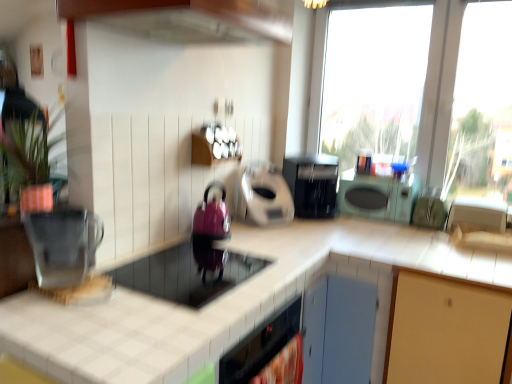
What do you see at coordinates (418, 102) in the screenshot? This screenshot has height=384, width=512. I see `transparent glass window at upper right` at bounding box center [418, 102].

This screenshot has width=512, height=384. I want to click on white matte toaster at center, the second appliance positioned from the right, so click(x=265, y=195).

Which appliance is the 1st one when counting from the right side of the metallic silver kettle at left, marked as the 5th appliance in a right-to-left arrangement? Please provide its 2D coordinates.

[(187, 273)]

Considering the relative sizes of metallic silver kettle at left, marked as the 5th appliance in a right-to-left arrangement, and shiny black kettle at center, which ranks as the 4th appliance in right-to-left order, in the image provided, is metallic silver kettle at left, marked as the 5th appliance in a right-to-left arrangement, bigger than shiny black kettle at center, which ranks as the 4th appliance in right-to-left order,?

Actually, metallic silver kettle at left, marked as the 5th appliance in a right-to-left arrangement, might be smaller than shiny black kettle at center, which ranks as the 4th appliance in right-to-left order.

Does metallic silver kettle at left, which is the first appliance from left to right, contain shiny black kettle at center, positioned as the second appliance in left-to-right order?

No, shiny black kettle at center, positioned as the second appliance in left-to-right order, is located outside of metallic silver kettle at left, which is the first appliance from left to right.

Can you confirm if metallic silver kettle at left, which is the first appliance from left to right, is shorter than shiny black kettle at center, positioned as the second appliance in left-to-right order?

Incorrect, the height of metallic silver kettle at left, which is the first appliance from left to right, does not fall short of that of shiny black kettle at center, positioned as the second appliance in left-to-right order.

Is matte pink kettle at center, the third appliance viewed from the left, facing away from green matte plant at upper left?

No, matte pink kettle at center, the third appliance viewed from the left,'s orientation is not away from green matte plant at upper left.

Is matte pink kettle at center, which is counted as the third appliance, starting from the right, inside the boundaries of green matte plant at upper left, or outside?

matte pink kettle at center, which is counted as the third appliance, starting from the right, exists outside the volume of green matte plant at upper left.

Based on the photo, which is more to the right, matte pink kettle at center, which is counted as the third appliance, starting from the right, or green matte plant at upper left?

From the viewer's perspective, matte pink kettle at center, which is counted as the third appliance, starting from the right, appears more on the right side.

From a real-world perspective, is matte pink kettle at center, the third appliance viewed from the left, over green matte plant at upper left?

No, from a real-world perspective, matte pink kettle at center, the third appliance viewed from the left, is not above green matte plant at upper left.

Does shiny black kettle at center, which ranks as the 4th appliance in right-to-left order, touch green matte plant at upper left?

shiny black kettle at center, which ranks as the 4th appliance in right-to-left order, and green matte plant at upper left are not in contact.

Which of these two, shiny black kettle at center, positioned as the second appliance in left-to-right order, or green matte plant at upper left, is bigger?

shiny black kettle at center, positioned as the second appliance in left-to-right order.

From the image's perspective, is shiny black kettle at center, which ranks as the 4th appliance in right-to-left order, beneath green matte plant at upper left?

Correct, shiny black kettle at center, which ranks as the 4th appliance in right-to-left order, appears lower than green matte plant at upper left in the image.

Identify the location of countertop that appears below the white matte toaster at center, the 4th appliance from the left (from a real-world perspective). (229, 302).

Is beige tile countertop at center not close to white matte toaster at center, the second appliance positioned from the right?

No, there isn't a large distance between beige tile countertop at center and white matte toaster at center, the second appliance positioned from the right.

Can you confirm if beige tile countertop at center is bigger than white matte toaster at center, the 4th appliance from the left?

Yes.

Is beige tile countertop at center inside or outside of white matte toaster at center, the second appliance positioned from the right?

beige tile countertop at center lies outside white matte toaster at center, the second appliance positioned from the right.

Between point (207, 262) and point (208, 238), which one is positioned in front?

Point (207, 262)

Could you tell me if shiny black kettle at center, positioned as the second appliance in left-to-right order, is turned towards matte pink kettle at center, which is counted as the third appliance, starting from the right?

No, shiny black kettle at center, positioned as the second appliance in left-to-right order, is not aimed at matte pink kettle at center, which is counted as the third appliance, starting from the right.

Considering the sizes of objects shiny black kettle at center, which ranks as the 4th appliance in right-to-left order, and matte pink kettle at center, the third appliance viewed from the left, in the image provided, who is shorter, shiny black kettle at center, which ranks as the 4th appliance in right-to-left order, or matte pink kettle at center, the third appliance viewed from the left,?

With less height is shiny black kettle at center, which ranks as the 4th appliance in right-to-left order.

Would you say shiny black kettle at center, positioned as the second appliance in left-to-right order, is a long distance from matte pink kettle at center, which is counted as the third appliance, starting from the right?

No, shiny black kettle at center, positioned as the second appliance in left-to-right order, is not far away from matte pink kettle at center, which is counted as the third appliance, starting from the right.

Considering the relative positions of black plastic coffee maker at center and metallic silver toaster at right, the 5th appliance when ordered from left to right, in the image provided, is black plastic coffee maker at center to the left or to the right of metallic silver toaster at right, the 5th appliance when ordered from left to right,?

From the image, it's evident that black plastic coffee maker at center is to the left of metallic silver toaster at right, the 5th appliance when ordered from left to right.

From a real-world perspective, who is located higher, black plastic coffee maker at center or metallic silver toaster at right, positioned as the 1th appliance in right-to-left order?

In real-world perspective, black plastic coffee maker at center is above.

Is black plastic coffee maker at center not inside metallic silver toaster at right, the 5th appliance when ordered from left to right?

Absolutely, black plastic coffee maker at center is external to metallic silver toaster at right, the 5th appliance when ordered from left to right.

From the picture: Measure the distance between black plastic coffee maker at center and metallic silver toaster at right, positioned as the 1th appliance in right-to-left order.

black plastic coffee maker at center is 23.93 inches away from metallic silver toaster at right, positioned as the 1th appliance in right-to-left order.

From the image's perspective, which one is positioned lower, matte pink kettle at center, the third appliance viewed from the left, or green matte microwave at center?

matte pink kettle at center, the third appliance viewed from the left.

Who is shorter, matte pink kettle at center, the third appliance viewed from the left, or green matte microwave at center?

With less height is green matte microwave at center.

From a real-world perspective, relative to green matte microwave at center, is matte pink kettle at center, which is counted as the third appliance, starting from the right, vertically above or below?

Clearly, from a real-world perspective, matte pink kettle at center, which is counted as the third appliance, starting from the right, is above green matte microwave at center.

Based on the photo, is matte pink kettle at center, the third appliance viewed from the left, further to camera compared to green matte microwave at center?

No, the depth of matte pink kettle at center, the third appliance viewed from the left, is less than that of green matte microwave at center.

The width and height of the screenshot is (512, 384). I want to click on appliance that is the 1st object located behind the metallic silver kettle at left, which is the first appliance from left to right, so click(x=187, y=273).

Find the location of a particular element. The image size is (512, 384). the 2nd appliance below when counting from the green matte plant at upper left (from the image's perspective) is located at coordinates (212, 216).

Considering their positions, is shiny black kettle at center, positioned as the second appliance in left-to-right order, positioned further to green matte microwave at center than transparent glass window at upper right?

shiny black kettle at center, positioned as the second appliance in left-to-right order, is positioned further to the anchor green matte microwave at center.

Based on their spatial positions, is metallic silver kettle at left, marked as the 5th appliance in a right-to-left arrangement, or black plastic coffee maker at center closer to metallic silver toaster at right, positioned as the 1th appliance in right-to-left order?

black plastic coffee maker at center.

Considering their positions, is black plastic coffee maker at center positioned further to green matte plant at upper left than matte pink kettle at center, which is counted as the third appliance, starting from the right?

black plastic coffee maker at center lies further to green matte plant at upper left than the other object.

Looking at the image, which one is located closer to green matte microwave at center, green matte plant at upper left or shiny black kettle at center, positioned as the second appliance in left-to-right order?

shiny black kettle at center, positioned as the second appliance in left-to-right order, is closer to green matte microwave at center.

When comparing their distances from transparent glass window at upper right, does shiny black kettle at center, positioned as the second appliance in left-to-right order, or white matte toaster at center, the second appliance positioned from the right, seem further?

shiny black kettle at center, positioned as the second appliance in left-to-right order, is positioned further to the anchor transparent glass window at upper right.

When comparing their distances from black plastic coffee maker at center, does metallic silver kettle at left, which is the first appliance from left to right, or shiny black kettle at center, which ranks as the 4th appliance in right-to-left order, seem closer?

Based on the image, shiny black kettle at center, which ranks as the 4th appliance in right-to-left order, appears to be nearer to black plastic coffee maker at center.

Estimate the real-world distances between objects in this image. Which object is closer to transparent glass window at upper right, white matte toaster at center, the 4th appliance from the left, or black plastic coffee maker at center?

The object closer to transparent glass window at upper right is black plastic coffee maker at center.

When comparing their distances from matte pink kettle at center, which is counted as the third appliance, starting from the right, does metallic silver kettle at left, which is the first appliance from left to right, or beige tile countertop at center seem further?

The object further to matte pink kettle at center, which is counted as the third appliance, starting from the right, is metallic silver kettle at left, which is the first appliance from left to right.

You are a GUI agent. You are given a task and a screenshot of the screen. Output one action in this format:
    pyautogui.click(x=<x>, y=<y>)
    Task: Click on the appliance between metallic silver kettle at left, which is the first appliance from left to right, and matte pink kettle at center, the third appliance viewed from the left, from front to back
    
    Given the screenshot: What is the action you would take?
    pyautogui.click(x=187, y=273)

This screenshot has width=512, height=384. Identify the location of kitchen appliance situated between matte pink kettle at center, the third appliance viewed from the left, and transparent glass window at upper right from left to right. pos(312,184).

Find the location of a particular element. Image resolution: width=512 pixels, height=384 pixels. kitchen appliance located between shiny black kettle at center, positioned as the second appliance in left-to-right order, and transparent glass window at upper right in the left-right direction is located at coordinates click(312, 184).

The height and width of the screenshot is (384, 512). Find the location of `appliance between matte pink kettle at center, which is counted as the third appliance, starting from the right, and green matte microwave at center`. appliance between matte pink kettle at center, which is counted as the third appliance, starting from the right, and green matte microwave at center is located at coordinates (265, 195).